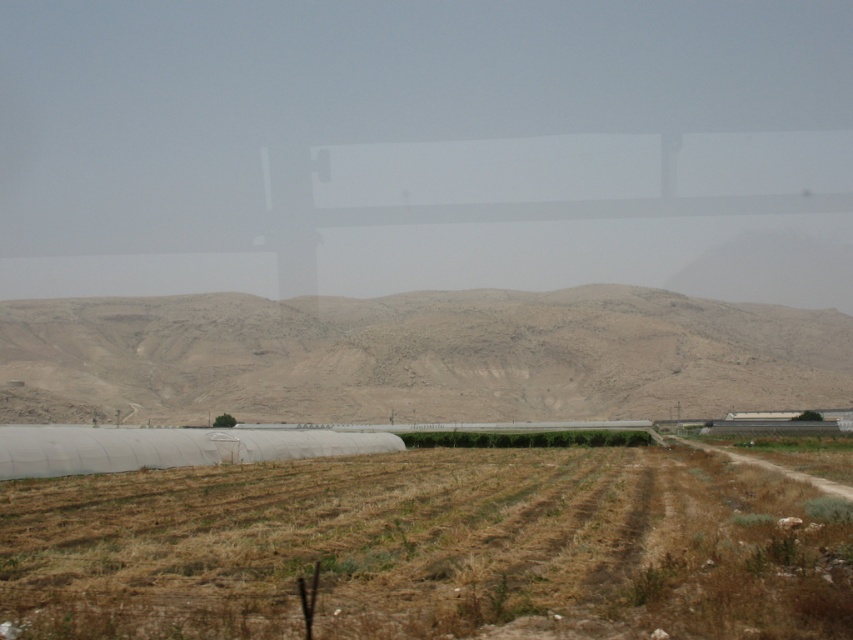
Who is lower down, brown grassy field at lower center or desert-like brown mountain at center?

brown grassy field at lower center is lower down.

The height and width of the screenshot is (640, 853). Identify the location of brown grassy field at lower center. (428, 548).